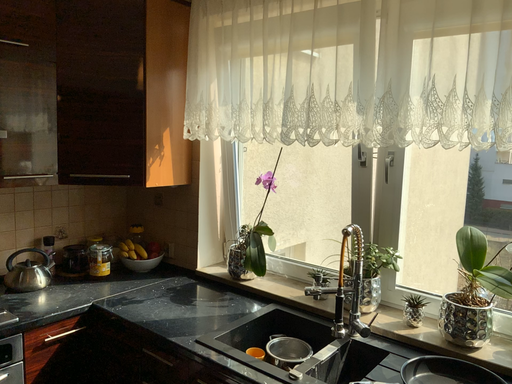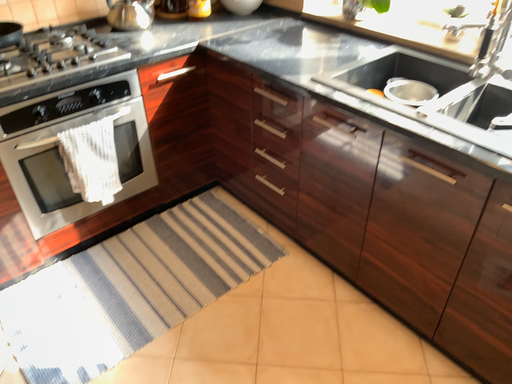
Question: How did the camera likely rotate when shooting the video?

Choices:
 (A) rotated left
 (B) rotated right

Answer: (A)